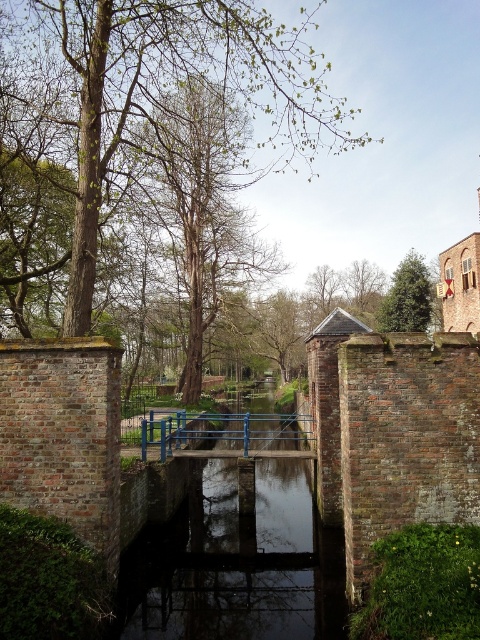
Is the position of green leafy tree at upper left more distant than that of green leafy tree at upper center?

No, green leafy tree at upper left is closer to the viewer.

Does point (205, 45) come farther from viewer compared to point (377, 278)?

No, (205, 45) is closer to viewer.

Image resolution: width=480 pixels, height=640 pixels. What are the coordinates of `green leafy tree at upper left` in the screenshot? It's located at (166, 99).

Who is higher up, brown wood tree at center or green textured tree at upper right?

brown wood tree at center

At what (x,y) coordinates should I click in order to perform the action: click on brown wood tree at center. Please return your answer as a coordinate pair (x, y). Image resolution: width=480 pixels, height=640 pixels. Looking at the image, I should click on (201, 204).

Which is below, brown wood tree at center or green leafy tree at upper center?

green leafy tree at upper center is lower down.

From the picture: Which of these two, brown wood tree at center or green leafy tree at upper center, stands taller?

brown wood tree at center is taller.

Is point (148, 160) in front of point (357, 262)?

Yes, point (148, 160) is in front of point (357, 262).

Identify the location of brown wood tree at center. The width and height of the screenshot is (480, 640). (201, 204).